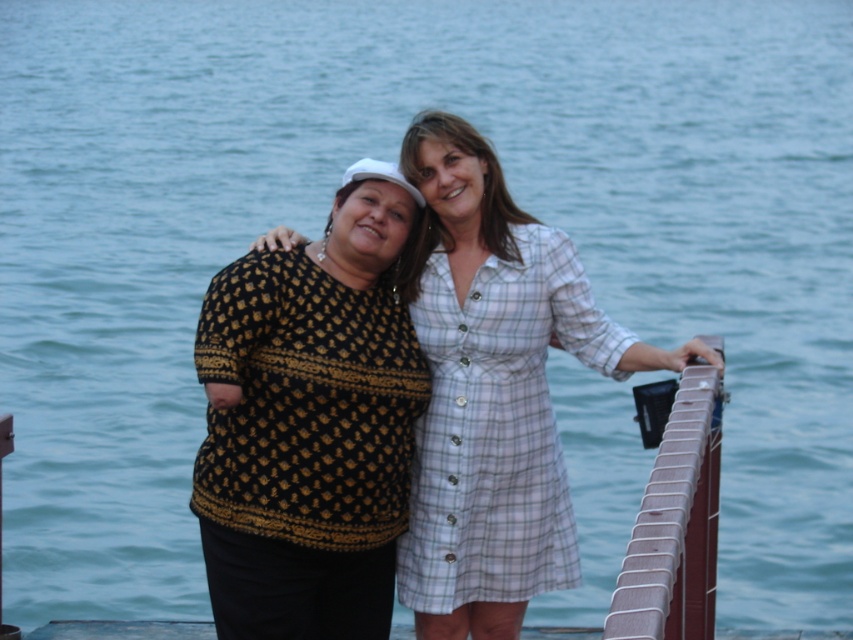
What is the 2D coordinate of the black knitwear at center in the image?

The 2D coordinate of the black knitwear at center is at point [310,422].

You are standing on the dock and want to pick up the black textured sweater at center. Which direction should you move to reach it?

The black textured sweater at center is located at point (x=494, y=390), so you should move towards the center of the dock to reach it.